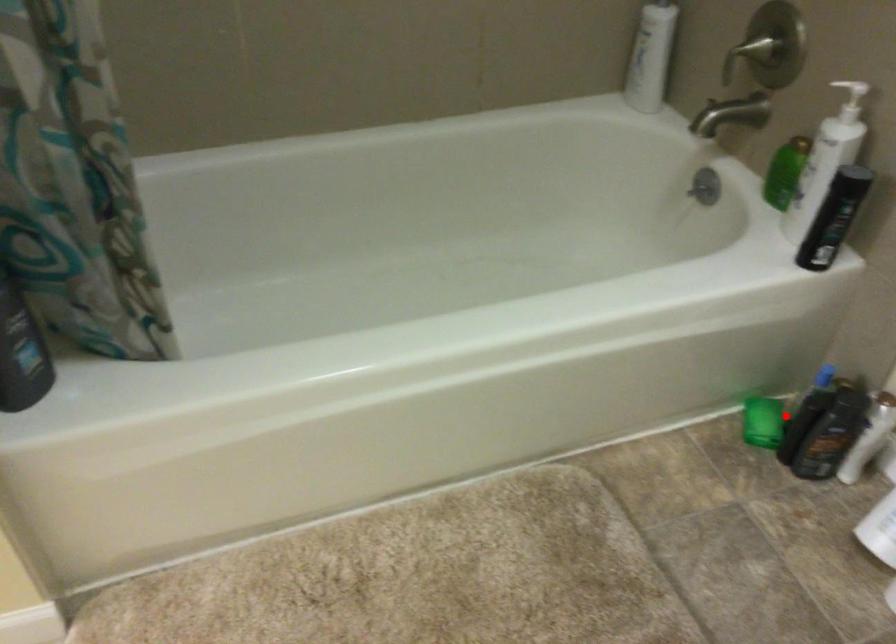
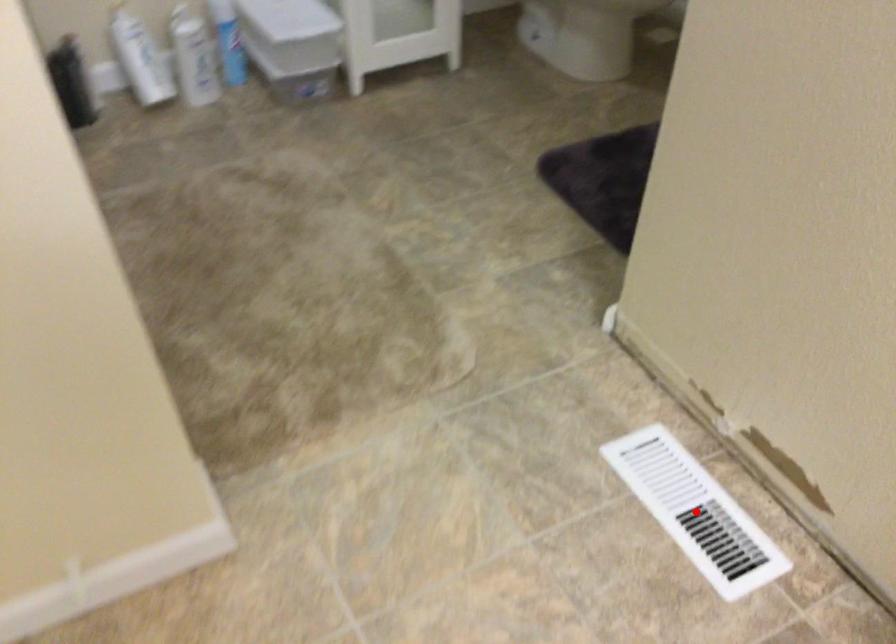
I am providing you with two images of the same scene from different viewpoints. A red point is marked on the first image and another point is marked on the second image. Is the red point in image1 aligned with the point shown in image2?

No